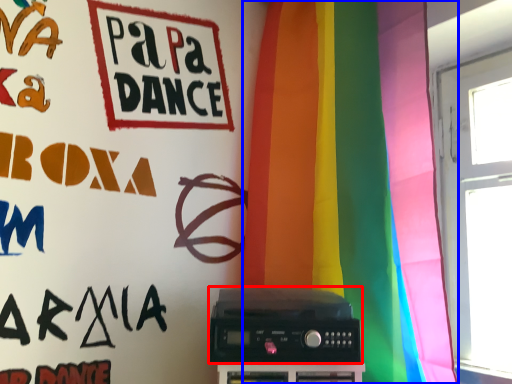
Question: Which object appears farthest to the camera in this image, amplifier (highlighted by a red box) or curtain (highlighted by a blue box)?

Choices:
 (A) amplifier
 (B) curtain

Answer: (A)